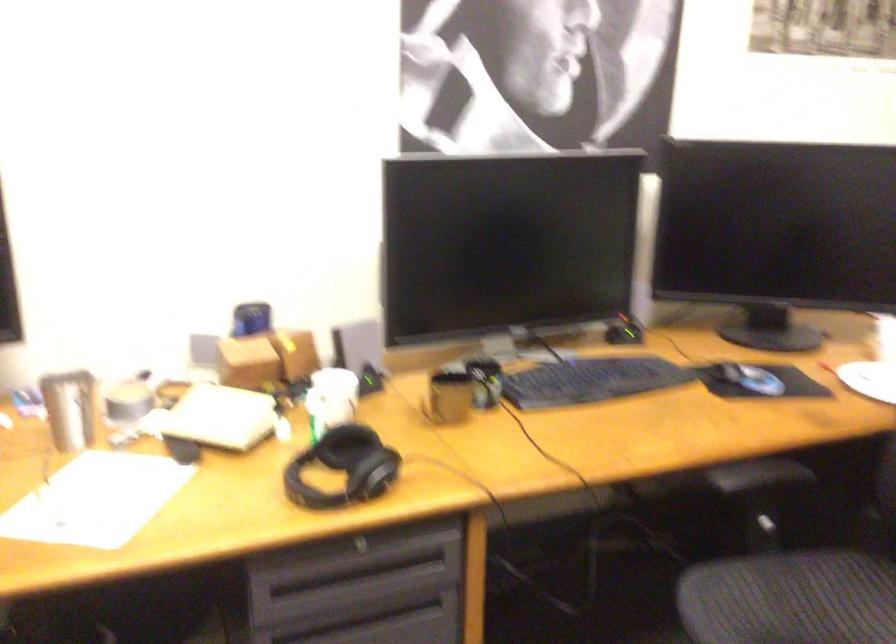
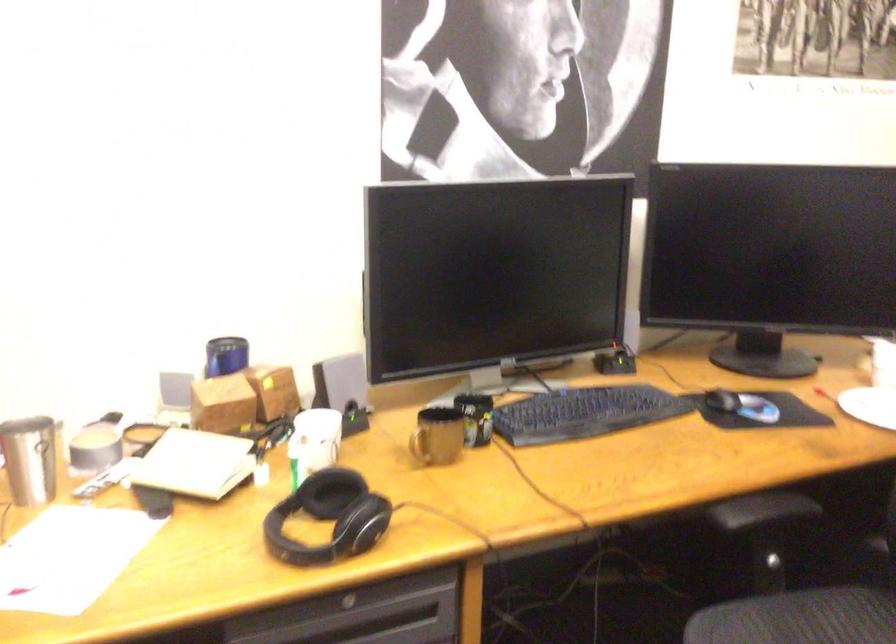
In the second image, find the point that corresponds to point (724, 371) in the first image.

(721, 400)